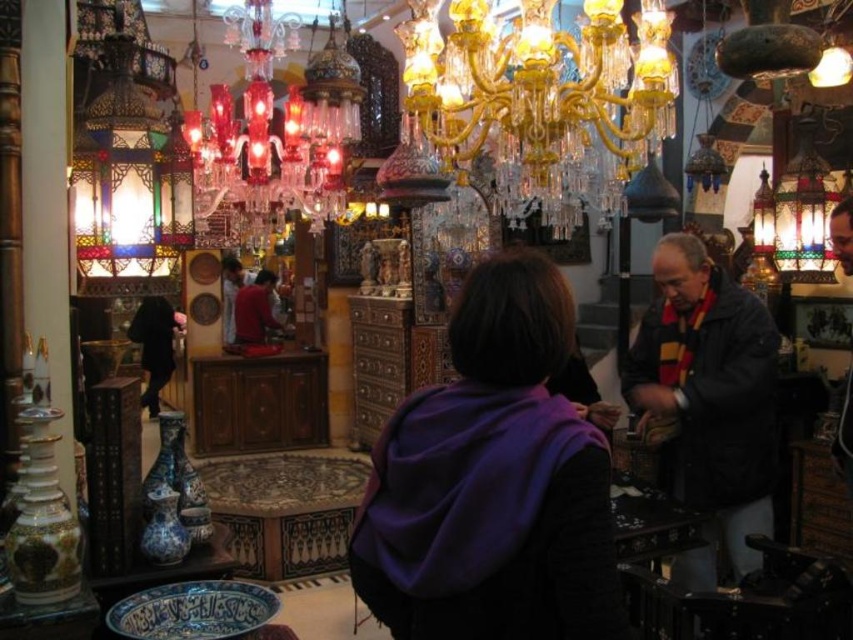
Question: Which point is closer to the camera?

Choices:
 (A) matte red shirt at center
 (B) gold crystal chandelier at center
 (C) translucent glass chandelier at upper left
 (D) purple fabric at center

Answer: (D)

Question: Does dark blue jacket at center lie in front of matte red shirt at center?

Choices:
 (A) no
 (B) yes

Answer: (B)

Question: Which of the following is the farthest from the observer?

Choices:
 (A) (618, 200)
 (B) (228, 218)
 (C) (236, 301)
 (D) (804, 193)

Answer: (C)

Question: Can you confirm if dark blue jacket at center is positioned to the left of matte red shirt at center?

Choices:
 (A) no
 (B) yes

Answer: (A)

Question: Which object is positioned farthest from the purple fabric at center?

Choices:
 (A) gold crystal chandelier at center
 (B) multicolored glass lantern at upper right
 (C) matte red shirt at center
 (D) dark blue jacket at center

Answer: (C)

Question: Is gold crystal chandelier at center to the left of multicolored glass lantern at upper right from the viewer's perspective?

Choices:
 (A) no
 (B) yes

Answer: (B)